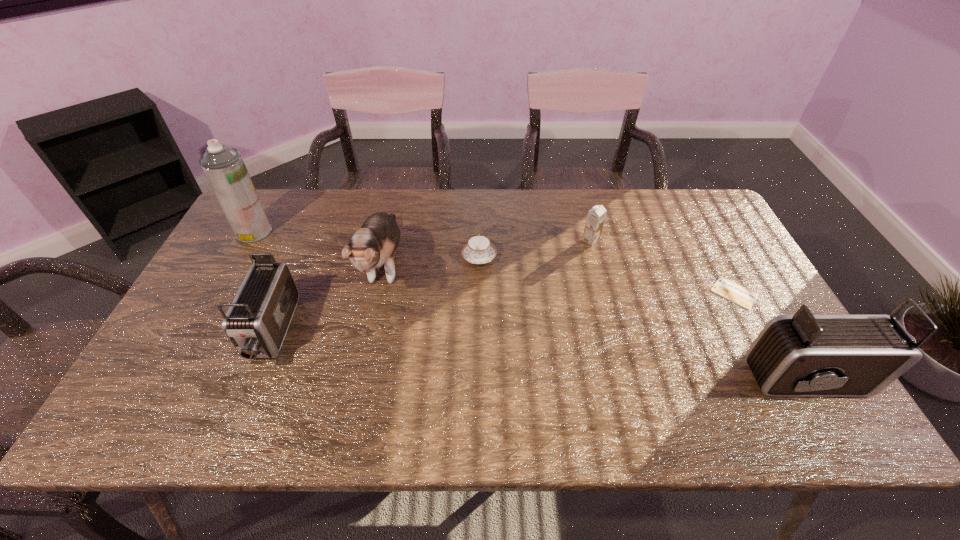
Locate an element on the screen. The width and height of the screenshot is (960, 540). the shortest object is located at coordinates (723, 287).

Locate an element on the screen. This screenshot has height=540, width=960. blank space located on the right of the leftmost object is located at coordinates (367, 232).

Find the location of a particular element. This screenshot has width=960, height=540. blank area located 0.080m at the face of the cat is located at coordinates (367, 347).

You are a GUI agent. You are given a task and a screenshot of the screen. Output one action in this format:
    pyautogui.click(x=<x>, y=<y>)
    Task: Click on the vacant region located on the side with the handle of the teacup
    The width and height of the screenshot is (960, 540).
    Given the screenshot: What is the action you would take?
    pyautogui.click(x=479, y=190)

Locate an element on the screen. The height and width of the screenshot is (540, 960). vacant position located 0.130m on the side with the handle of the teacup is located at coordinates (479, 218).

Identify the location of free space located 0.150m on the side with the handle of the teacup. The height and width of the screenshot is (540, 960). (479, 214).

Where is `free point located 0.100m on the left of the fifth object from left to right`? The width and height of the screenshot is (960, 540). free point located 0.100m on the left of the fifth object from left to right is located at coordinates (549, 240).

At what (x,y) coordinates should I click in order to perform the action: click on vacant area situated 0.250m on the back of the identity card. Please return your answer as a coordinate pair (x, y). Image resolution: width=960 pixels, height=540 pixels. Looking at the image, I should click on (696, 221).

Locate an element on the screen. The image size is (960, 540). aerosol can that is positioned at the far edge is located at coordinates (224, 168).

Where is `cat that is at the far edge`? The image size is (960, 540). cat that is at the far edge is located at coordinates (373, 245).